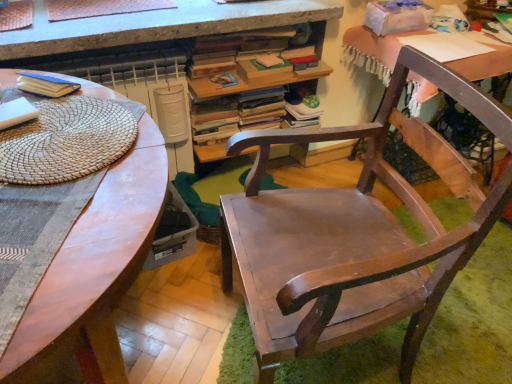
The height and width of the screenshot is (384, 512). Identify the location of free space that is in between matte blue paperback book at upper left and woven beige placemat at left. (46, 89).